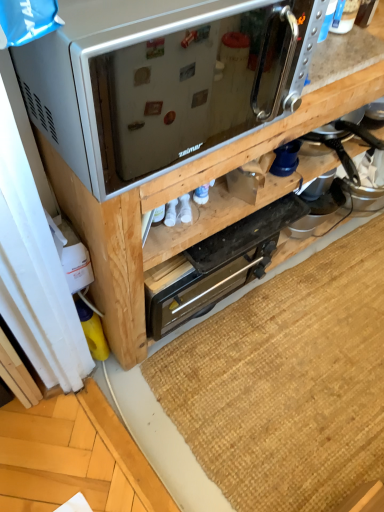
What are the coordinates of `brown woven mat at lower center` in the screenshot? It's located at (287, 382).

Based on the photo, from a real-world perspective, which is physically below, satin silver microwave at upper center or black metallic toaster oven at center?

black metallic toaster oven at center is physically lower.

Is satin silver microwave at upper center positioned with its back to black metallic toaster oven at center?

satin silver microwave at upper center is not turned away from black metallic toaster oven at center.

Who is bigger, satin silver microwave at upper center or black metallic toaster oven at center?

Bigger between the two is satin silver microwave at upper center.

Between satin silver microwave at upper center and metallic silver toaster oven at upper center, which one appears on the left side from the viewer's perspective?

Positioned to the left is satin silver microwave at upper center.

Is satin silver microwave at upper center placed right next to metallic silver toaster oven at upper center?

Yes.

Could you measure the distance between satin silver microwave at upper center and metallic silver toaster oven at upper center?

They are 3.43 inches apart.

From a real-world perspective, is satin silver microwave at upper center positioned above or below metallic silver toaster oven at upper center?

In terms of real-world spatial position, satin silver microwave at upper center is above metallic silver toaster oven at upper center.

Is metallic silver toaster oven at upper center touching brown woven mat at lower center?

metallic silver toaster oven at upper center and brown woven mat at lower center are clearly separated.

Is metallic silver toaster oven at upper center oriented away from brown woven mat at lower center?

No, metallic silver toaster oven at upper center is not facing the opposite direction of brown woven mat at lower center.

Considering the points (179, 82) and (305, 297), which point is in front, point (179, 82) or point (305, 297)?

Positioned in front is point (179, 82).

Image resolution: width=384 pixels, height=512 pixels. Identify the location of microwave oven that appears on the left of brown woven mat at lower center. (163, 82).

In the scene shown: Between satin silver microwave at upper center and brown woven mat at lower center, which one has larger width?

brown woven mat at lower center.

Looking at this image, considering the relative sizes of satin silver microwave at upper center and brown woven mat at lower center in the image provided, is satin silver microwave at upper center taller than brown woven mat at lower center?

Indeed, satin silver microwave at upper center has a greater height compared to brown woven mat at lower center.

From a real-world perspective, which is physically below, brown woven mat at lower center or satin silver microwave at upper center?

In real-world perspective, brown woven mat at lower center is lower.

Could you tell me if brown woven mat at lower center is facing satin silver microwave at upper center?

No, brown woven mat at lower center does not turn towards satin silver microwave at upper center.

Is the surface of brown woven mat at lower center in direct contact with satin silver microwave at upper center?

No.

Can you confirm if metallic silver toaster oven at upper center is thinner than black metallic toaster oven at center?

Incorrect, the width of metallic silver toaster oven at upper center is not less than that of black metallic toaster oven at center.

Can you confirm if metallic silver toaster oven at upper center is smaller than black metallic toaster oven at center?

No, metallic silver toaster oven at upper center is not smaller than black metallic toaster oven at center.

Is the surface of metallic silver toaster oven at upper center in direct contact with black metallic toaster oven at center?

No, metallic silver toaster oven at upper center is not making contact with black metallic toaster oven at center.

From the picture: Is metallic silver toaster oven at upper center completely or partially outside of black metallic toaster oven at center?

Yes, metallic silver toaster oven at upper center is outside of black metallic toaster oven at center.

From a real-world perspective, is metallic silver toaster oven at upper center over satin silver microwave at upper center?

No.

From the image's perspective, would you say metallic silver toaster oven at upper center is shown under satin silver microwave at upper center?

Yes, from the image's perspective, metallic silver toaster oven at upper center is below satin silver microwave at upper center.

Can you confirm if metallic silver toaster oven at upper center is smaller than satin silver microwave at upper center?

Actually, metallic silver toaster oven at upper center might be larger than satin silver microwave at upper center.

Who is taller, metallic silver toaster oven at upper center or satin silver microwave at upper center?

metallic silver toaster oven at upper center.

Find the location of `microwave oven in front of the black metallic toaster oven at center`. microwave oven in front of the black metallic toaster oven at center is located at coordinates (163, 82).

Image resolution: width=384 pixels, height=512 pixels. I want to click on cabinetry below the satin silver microwave at upper center (from a real-world perspective), so click(169, 129).

Based on their spatial positions, is black metallic toaster oven at center or metallic silver toaster oven at upper center further from brown woven mat at lower center?

The object further to brown woven mat at lower center is metallic silver toaster oven at upper center.

Based on their spatial positions, is metallic silver toaster oven at upper center or brown woven mat at lower center further from black metallic toaster oven at center?

brown woven mat at lower center is further to black metallic toaster oven at center.

From the image, which object appears to be nearer to metallic silver toaster oven at upper center, black metallic toaster oven at center or brown woven mat at lower center?

Among the two, black metallic toaster oven at center is located nearer to metallic silver toaster oven at upper center.

When comparing their distances from satin silver microwave at upper center, does black metallic toaster oven at center or brown woven mat at lower center seem further?

The object further to satin silver microwave at upper center is brown woven mat at lower center.

Estimate the real-world distances between objects in this image. Which object is further from brown woven mat at lower center, satin silver microwave at upper center or metallic silver toaster oven at upper center?

Based on the image, satin silver microwave at upper center appears to be further to brown woven mat at lower center.

Which object lies nearer to the anchor point black metallic toaster oven at center, brown woven mat at lower center or satin silver microwave at upper center?

brown woven mat at lower center is closer to black metallic toaster oven at center.

Consider the image. From the image, which object appears to be nearer to metallic silver toaster oven at upper center, black metallic toaster oven at center or satin silver microwave at upper center?

Among the two, satin silver microwave at upper center is located nearer to metallic silver toaster oven at upper center.

Considering their positions, is satin silver microwave at upper center positioned closer to black metallic toaster oven at center than brown woven mat at lower center?

The object closer to black metallic toaster oven at center is brown woven mat at lower center.

The height and width of the screenshot is (512, 384). I want to click on appliance between satin silver microwave at upper center and brown woven mat at lower center along the z-axis, so click(216, 266).

The width and height of the screenshot is (384, 512). I want to click on cabinetry between satin silver microwave at upper center and brown woven mat at lower center vertically, so click(169, 129).

You are a GUI agent. You are given a task and a screenshot of the screen. Output one action in this format:
    pyautogui.click(x=<x>, y=<y>)
    Task: Click on the appliance that lies between metallic silver toaster oven at upper center and brown woven mat at lower center from top to bottom
    The image size is (384, 512).
    Given the screenshot: What is the action you would take?
    pyautogui.click(x=216, y=266)

The width and height of the screenshot is (384, 512). I want to click on cabinetry between satin silver microwave at upper center and black metallic toaster oven at center from front to back, so click(x=169, y=129).